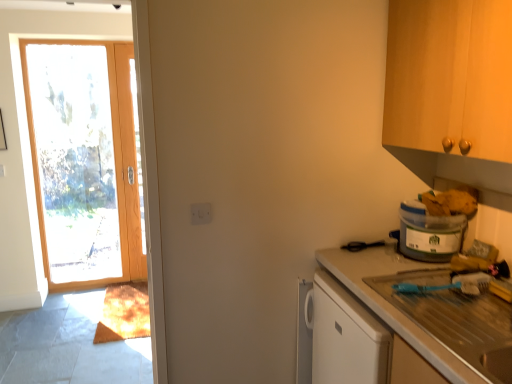
What are the coordinates of `free spot above smooth white countertop at right (from a real-world perspective)` in the screenshot? It's located at (381, 271).